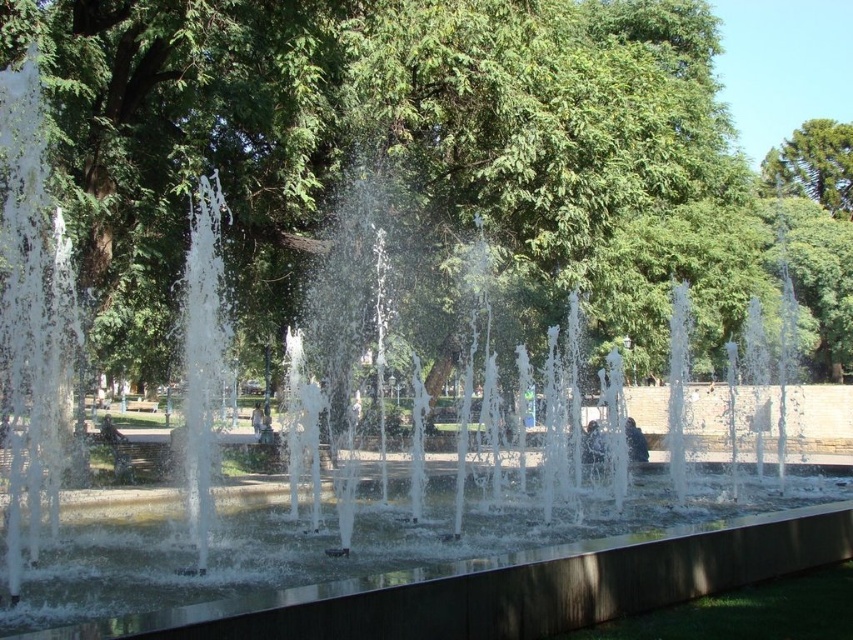
You are standing in the park and want to find the tallest tree to rest under. Which tree should you choose between the green leafy tree at center and the green leafy tree at upper right?

The green leafy tree at center is much taller than the green leafy tree at upper right, so you should choose the green leafy tree at center to rest under.

You are standing at the fountain in the image and want to take a photo of the green leafy tree at center. Which direction should you face to capture it in your shot?

Since the green leafy tree at center is located at point coordinates of [421,161], you should face towards the center area of the scene to capture it in your photo.

You are standing in the park and want to walk from the fountain towards the green leafy tree at upper right. Which direction should you head relative to the green leafy tree at center?

You should head to the right of the green leafy tree at center because the green leafy tree at upper right is positioned to the right side of the green leafy tree at center.